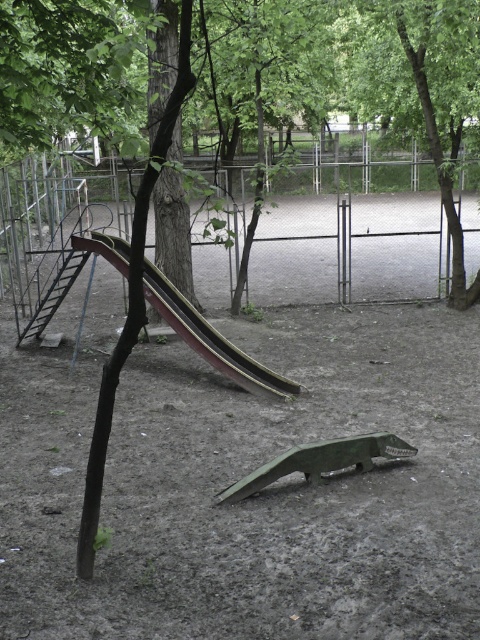
Measure the distance between green leafy tree at center and wooden smooth slide at left.

green leafy tree at center is 5.87 meters away from wooden smooth slide at left.

Is point (420, 86) farther from viewer compared to point (167, 305)?

Yes, point (420, 86) is behind point (167, 305).

Does point (365, 61) lie behind point (195, 314)?

Yes, it is.

Where is `green leafy tree at center`? Image resolution: width=480 pixels, height=640 pixels. green leafy tree at center is located at coordinates (420, 88).